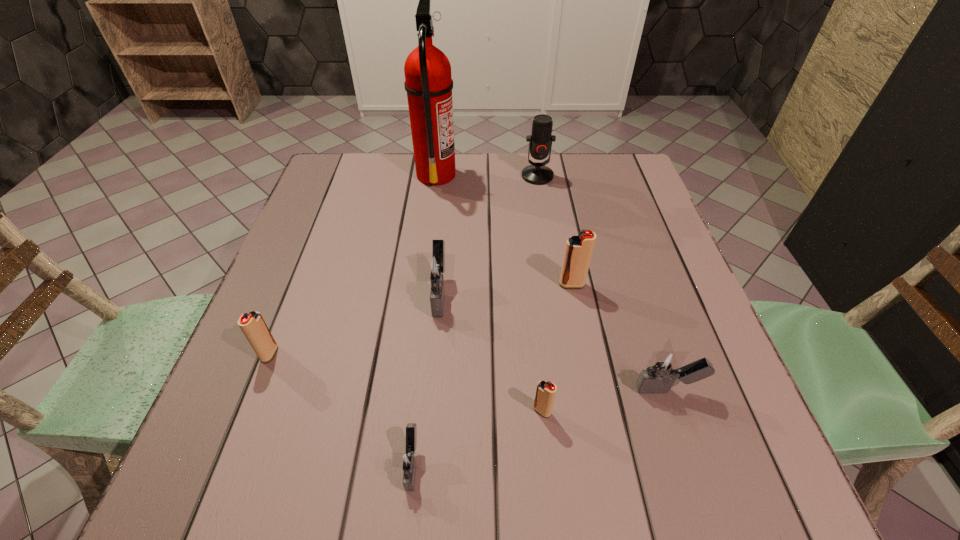
Identify the location of vacant point located 0.250m on the left of the nearest igniter. The width and height of the screenshot is (960, 540). (241, 464).

At what (x,y) coordinates should I click in order to perform the action: click on fire extinguisher that is at the far edge. Please return your answer as a coordinate pair (x, y). This screenshot has width=960, height=540. Looking at the image, I should click on (428, 82).

The width and height of the screenshot is (960, 540). I want to click on microphone located at the far edge, so click(x=540, y=141).

Where is `object at the near edge`? object at the near edge is located at coordinates (409, 461).

Locate an element on the screen. The image size is (960, 540). object present at the left edge is located at coordinates (253, 326).

This screenshot has width=960, height=540. In order to click on object present at the right edge in this screenshot , I will do `click(664, 367)`.

This screenshot has height=540, width=960. I want to click on free space at the far edge, so click(558, 159).

Locate an element on the screen. Image resolution: width=960 pixels, height=540 pixels. free spot at the near edge of the desktop is located at coordinates (516, 464).

At what (x,y) coordinates should I click in order to perform the action: click on vacant region at the left edge of the desktop. Please return your answer as a coordinate pair (x, y). This screenshot has height=540, width=960. Looking at the image, I should click on (302, 392).

The height and width of the screenshot is (540, 960). In order to click on vacant space at the right edge of the desktop in this screenshot , I will do `click(633, 213)`.